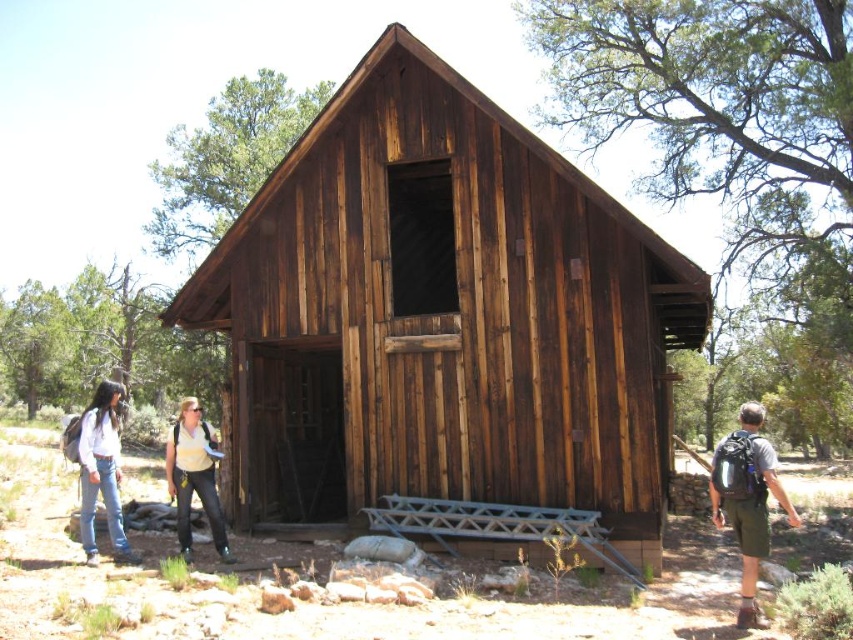
Can you confirm if brown wooden cabin at center is thinner than matte gray backpack at right?

Indeed, brown wooden cabin at center has a lesser width compared to matte gray backpack at right.

Identify the location of brown wooden cabin at center. This screenshot has height=640, width=853. (444, 316).

Is point (343, 221) positioned behind point (103, 444)?

Yes, it is.

Who is higher up, brown wooden cabin at center or denim jeans at lower left?

brown wooden cabin at center is higher up.

Does point (357, 257) come in front of point (90, 502)?

No, (357, 257) is behind (90, 502).

Find the location of a particular element. The height and width of the screenshot is (640, 853). brown wooden cabin at center is located at coordinates (444, 316).

Can you confirm if denim jeans at lower left is bigger than matte yellow shirt at center?

A: Indeed, denim jeans at lower left has a larger size compared to matte yellow shirt at center.

Is point (113, 385) closer to viewer compared to point (195, 426)?

That is True.

What do you see at coordinates (102, 472) in the screenshot? I see `denim jeans at lower left` at bounding box center [102, 472].

In order to click on denim jeans at lower left in this screenshot , I will do `click(102, 472)`.